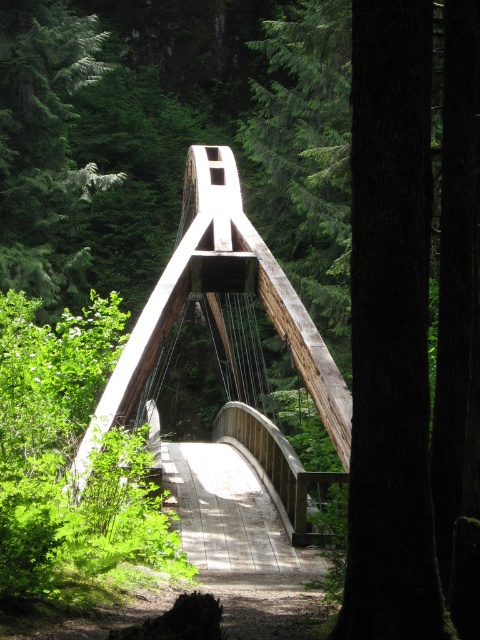
You are standing on the wooden suspension bridge and want to know which object is closer to the ground between the dark brown wood at center and the green textured tree at center. Which one is closer?

The dark brown wood at center is closer to the ground because it is shorter than the green textured tree at center.

You are standing on the wooden suspension bridge and need to place a small decorative item exactly at the center of the dark brown wood at center. According to the coordinates provided, where should you place it?

The dark brown wood at center is located at point (391,332), so you should place the item at those coordinates.